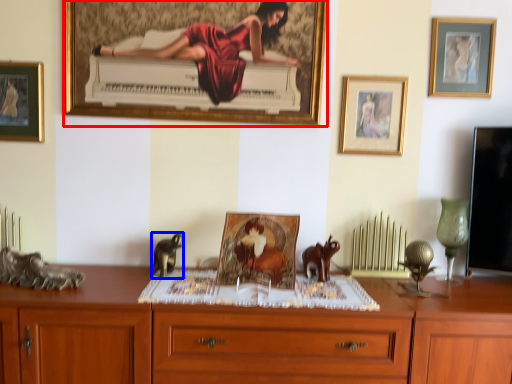
Question: Which of the following is the farthest to the observer, picture frame (highlighted by a red box) or animal (highlighted by a blue box)?

Choices:
 (A) picture frame
 (B) animal

Answer: (A)